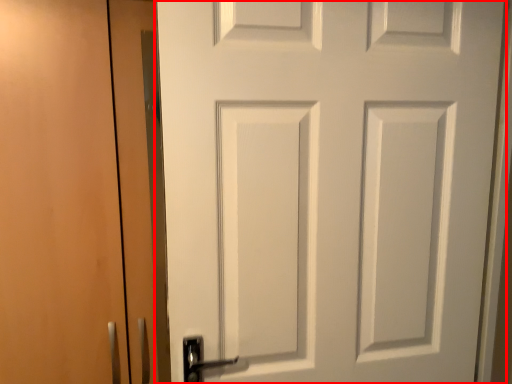
Question: From the image's perspective, what is the correct spatial positioning of door (annotated by the red box) in reference to garage door?

Choices:
 (A) above
 (B) below

Answer: (A)